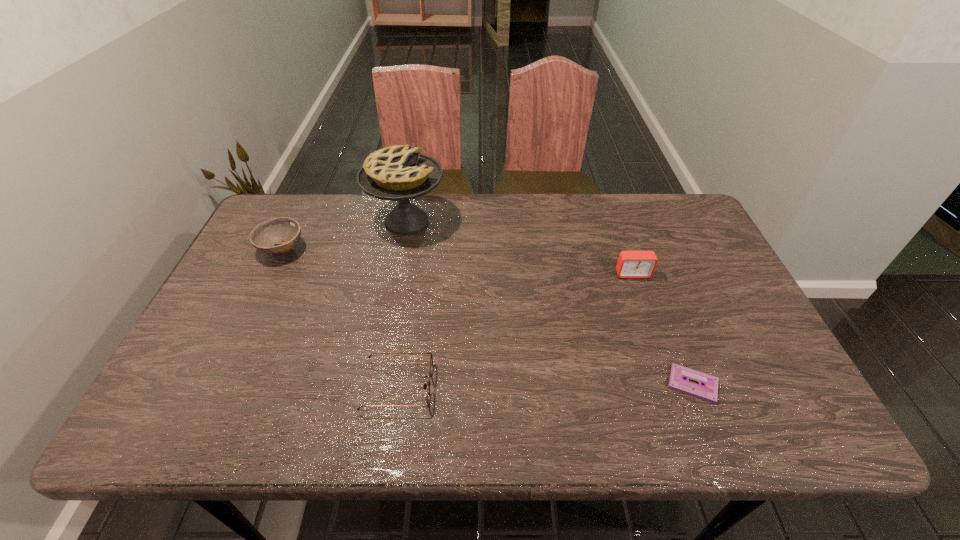
The width and height of the screenshot is (960, 540). What are the coordinates of `pie located in the far edge section of the desktop` in the screenshot? It's located at (399, 173).

At what (x,y) coordinates should I click in order to perform the action: click on bowl located in the far edge section of the desktop. Please return your answer as a coordinate pair (x, y). Image resolution: width=960 pixels, height=540 pixels. Looking at the image, I should click on (286, 231).

I want to click on sunglasses located in the near edge section of the desktop, so click(431, 358).

This screenshot has width=960, height=540. What are the coordinates of `videotape present at the near edge` in the screenshot? It's located at (708, 391).

You are a GUI agent. You are given a task and a screenshot of the screen. Output one action in this format:
    pyautogui.click(x=<x>, y=<y>)
    Task: Click on the object at the left edge
    This screenshot has height=540, width=960.
    Given the screenshot: What is the action you would take?
    pyautogui.click(x=286, y=231)

At what (x,y) coordinates should I click in order to perform the action: click on object that is at the right edge. Please return your answer as a coordinate pair (x, y). The image size is (960, 540). Looking at the image, I should click on pyautogui.click(x=708, y=391).

Where is `object that is at the far left corner`? object that is at the far left corner is located at coordinates (286, 231).

Where is `object that is at the near right corner`? Image resolution: width=960 pixels, height=540 pixels. object that is at the near right corner is located at coordinates (708, 391).

The image size is (960, 540). Identify the location of vacant space at the far edge. (432, 231).

Where is `vacant area at the near edge`? The height and width of the screenshot is (540, 960). vacant area at the near edge is located at coordinates (591, 436).